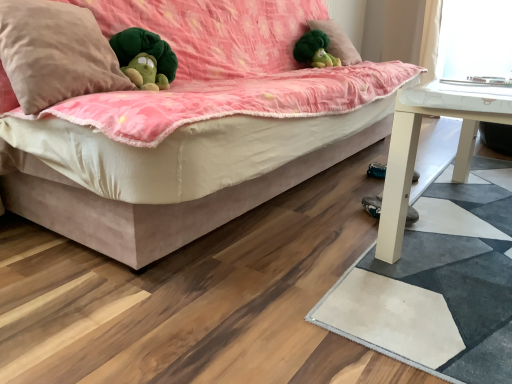
Locate an element on the screen. The height and width of the screenshot is (384, 512). free region under white matte mat at lower right (from a real-world perspective) is located at coordinates (451, 261).